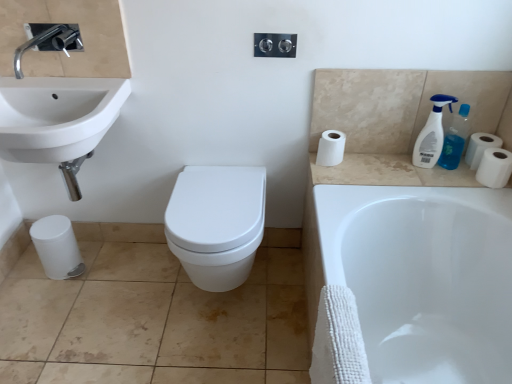
Locate an element on the screen. The width and height of the screenshot is (512, 384). free spot below white glossy sink at upper left (from a real-world perspective) is located at coordinates (96, 276).